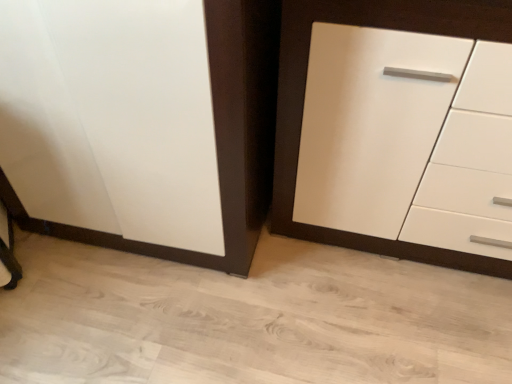
Question: Should I look upward or downward to see white glossy cabinet at center right?

Choices:
 (A) down
 (B) up

Answer: (B)

Question: Is white glossy cabinet at center right facing towards white glossy cupboard at left?

Choices:
 (A) yes
 (B) no

Answer: (B)

Question: Is white glossy cabinet at center right smaller than white glossy cupboard at left?

Choices:
 (A) no
 (B) yes

Answer: (B)

Question: Can you confirm if white glossy cabinet at center right is bigger than white glossy cupboard at left?

Choices:
 (A) no
 (B) yes

Answer: (A)

Question: Could white glossy cupboard at left be considered to be inside white glossy cabinet at center right?

Choices:
 (A) yes
 (B) no

Answer: (B)

Question: Is white glossy cabinet at center right shorter than white glossy cupboard at left?

Choices:
 (A) yes
 (B) no

Answer: (B)

Question: Considering the relative sizes of white glossy cabinet at center right and white glossy cupboard at left in the image provided, is white glossy cabinet at center right wider than white glossy cupboard at left?

Choices:
 (A) no
 (B) yes

Answer: (A)

Question: Is white glossy cupboard at left turned away from white glossy cabinet at center right?

Choices:
 (A) yes
 (B) no

Answer: (B)

Question: From the image's perspective, does white glossy cupboard at left appear higher than white glossy cabinet at center right?

Choices:
 (A) yes
 (B) no

Answer: (A)

Question: Is white glossy cupboard at left further to camera compared to white glossy cabinet at center right?

Choices:
 (A) yes
 (B) no

Answer: (A)

Question: From the image's perspective, is white glossy cupboard at left under white glossy cabinet at center right?

Choices:
 (A) yes
 (B) no

Answer: (B)

Question: Does white glossy cupboard at left have a greater width compared to white glossy cabinet at center right?

Choices:
 (A) no
 (B) yes

Answer: (B)

Question: Considering the relative sizes of white glossy cupboard at left and white glossy cabinet at center right in the image provided, is white glossy cupboard at left shorter than white glossy cabinet at center right?

Choices:
 (A) yes
 (B) no

Answer: (A)

Question: Considering the positions of white glossy cupboard at left and white glossy cabinet at center right in the image, is white glossy cupboard at left taller or shorter than white glossy cabinet at center right?

Choices:
 (A) short
 (B) tall

Answer: (A)